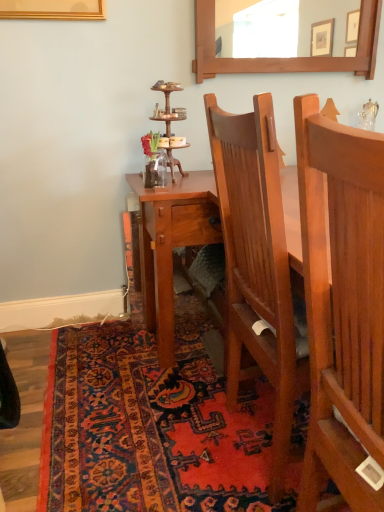
Question: From a real-world perspective, does wooden mirror at upper center stand above carpeted rug at lower center?

Choices:
 (A) no
 (B) yes

Answer: (B)

Question: Is wooden mirror at upper center to the right of carpeted rug at lower center from the viewer's perspective?

Choices:
 (A) no
 (B) yes

Answer: (B)

Question: From the image's perspective, would you say wooden mirror at upper center is positioned over carpeted rug at lower center?

Choices:
 (A) no
 (B) yes

Answer: (B)

Question: Is carpeted rug at lower center inside wooden mirror at upper center?

Choices:
 (A) no
 (B) yes

Answer: (A)

Question: Is wooden mirror at upper center located outside carpeted rug at lower center?

Choices:
 (A) no
 (B) yes

Answer: (B)

Question: From a real-world perspective, does wooden mirror at upper center sit lower than carpeted rug at lower center?

Choices:
 (A) yes
 (B) no

Answer: (B)

Question: From a real-world perspective, is carpeted rug at lower center located beneath wooden mirror at upper center?

Choices:
 (A) no
 (B) yes

Answer: (B)

Question: Is carpeted rug at lower center outside wooden mirror at upper center?

Choices:
 (A) yes
 (B) no

Answer: (A)

Question: Is carpeted rug at lower center oriented towards wooden mirror at upper center?

Choices:
 (A) yes
 (B) no

Answer: (B)

Question: From the image's perspective, is carpeted rug at lower center below wooden mirror at upper center?

Choices:
 (A) yes
 (B) no

Answer: (A)

Question: Are carpeted rug at lower center and wooden mirror at upper center located far from each other?

Choices:
 (A) no
 (B) yes

Answer: (B)

Question: Is carpeted rug at lower center placed right next to wooden mirror at upper center?

Choices:
 (A) yes
 (B) no

Answer: (B)

Question: From the image's perspective, does carpeted rug at lower center appear lower than light brown wood chair at center?

Choices:
 (A) no
 (B) yes

Answer: (B)